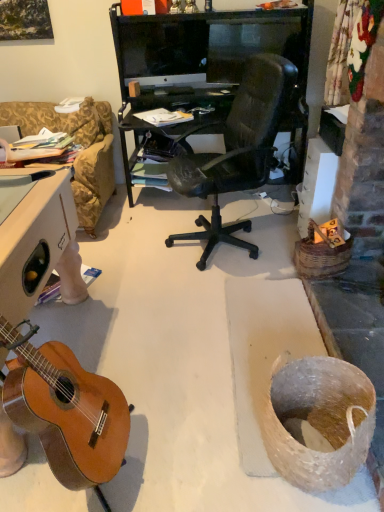
At what (x,y) coordinates should I click in order to perform the action: click on matte black monitor at upper center. Please return your answer as a coordinate pair (x, y). Looking at the image, I should click on (164, 50).

Describe the element at coordinates (164, 50) in the screenshot. I see `matte black monitor at upper center` at that location.

Where is `natural wood guitar at lower left`? The image size is (384, 512). natural wood guitar at lower left is located at coordinates (66, 411).

The height and width of the screenshot is (512, 384). What do you see at coordinates (66, 411) in the screenshot?
I see `natural wood guitar at lower left` at bounding box center [66, 411].

The height and width of the screenshot is (512, 384). What are the coordinates of `matte black monitor at upper center` in the screenshot? It's located at (164, 50).

Between natural wood guitar at lower left and matte black monitor at upper center, which one appears on the right side from the viewer's perspective?

matte black monitor at upper center.

Is the depth of natural wood guitar at lower left greater than that of matte black monitor at upper center?

No, natural wood guitar at lower left is closer to the camera.

Which is in front, point (126, 426) or point (207, 52)?

Point (126, 426)

From the image's perspective, is natural wood guitar at lower left on top of matte black monitor at upper center?

Actually, natural wood guitar at lower left appears below matte black monitor at upper center in the image.

From a real-world perspective, who is located higher, natural wood guitar at lower left or matte black monitor at upper center?

matte black monitor at upper center is physically above.

Considering the sizes of objects natural wood guitar at lower left and matte black monitor at upper center in the image provided, who is wider, natural wood guitar at lower left or matte black monitor at upper center?

Wider between the two is natural wood guitar at lower left.

Is natural wood guitar at lower left shorter than matte black monitor at upper center?

In fact, natural wood guitar at lower left may be taller than matte black monitor at upper center.

Between natural wood guitar at lower left and matte black monitor at upper center, which one has smaller size?

With smaller size is matte black monitor at upper center.

Which is correct: natural wood guitar at lower left is inside matte black monitor at upper center, or outside of it?

natural wood guitar at lower left is located beyond the bounds of matte black monitor at upper center.

Is natural wood guitar at lower left touching matte black monitor at upper center?

No.

Could you tell me if natural wood guitar at lower left is turned towards matte black monitor at upper center?

No.

At what (x,y) coordinates should I click in order to perform the action: click on guitar in front of the matte black monitor at upper center. Please return your answer as a coordinate pair (x, y). Looking at the image, I should click on (66, 411).

Which object is positioned more to the right, matte black monitor at upper center or natural wood guitar at lower left?

Positioned to the right is matte black monitor at upper center.

Which object is more forward, matte black monitor at upper center or natural wood guitar at lower left?

natural wood guitar at lower left.

Is point (200, 61) positioned after point (114, 390)?

Yes, it is.

From the image's perspective, does matte black monitor at upper center appear higher than natural wood guitar at lower left?

Result: Yes, from the image's perspective, matte black monitor at upper center is on top of natural wood guitar at lower left.

Looking at this image, from a real-world perspective, is matte black monitor at upper center physically below natural wood guitar at lower left?

No, from a real-world perspective, matte black monitor at upper center is not below natural wood guitar at lower left.

Considering the relative sizes of matte black monitor at upper center and natural wood guitar at lower left in the image provided, is matte black monitor at upper center thinner than natural wood guitar at lower left?

Indeed, matte black monitor at upper center has a lesser width compared to natural wood guitar at lower left.

Is matte black monitor at upper center taller or shorter than natural wood guitar at lower left?

matte black monitor at upper center is shorter than natural wood guitar at lower left.

Is matte black monitor at upper center bigger or smaller than natural wood guitar at lower left?

Clearly, matte black monitor at upper center is smaller in size than natural wood guitar at lower left.

Do you think matte black monitor at upper center is within natural wood guitar at lower left, or outside of it?

matte black monitor at upper center is outside natural wood guitar at lower left.

Is matte black monitor at upper center beside natural wood guitar at lower left?

They are not placed beside each other.

Could you tell me if matte black monitor at upper center is turned towards natural wood guitar at lower left?

Yes.

Locate an element on the screen. guitar below the matte black monitor at upper center (from the image's perspective) is located at coordinates (66, 411).

Image resolution: width=384 pixels, height=512 pixels. In order to click on computer monitor on the right of natural wood guitar at lower left in this screenshot , I will do `click(164, 50)`.

At what (x,y) coordinates should I click in order to perform the action: click on guitar that appears on the left of matte black monitor at upper center. Please return your answer as a coordinate pair (x, y). The height and width of the screenshot is (512, 384). Looking at the image, I should click on (66, 411).